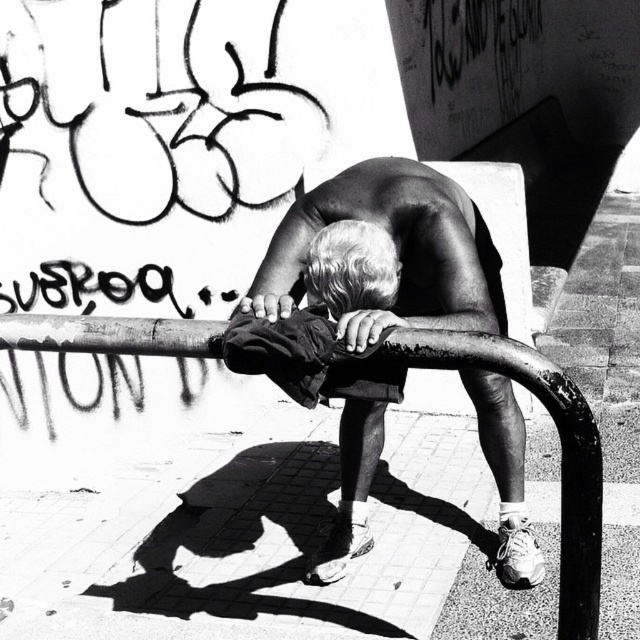
You are an artist trying to sketch the man in the image. To ensure accuracy, you need to know the exact location of his dark fabric shorts at center. Can you describe where they are positioned relative to the image frame?

The dark fabric shorts at center are positioned at coordinates point [332,369] relative to the image frame.

You are a photographer standing in front of the graffiti wall and want to place a small sticker on the point that is closer to you. Which point should you choose between point (x=364, y=228) and point (x=589, y=596)?

Point (x=589, y=596) is closer to you than point (x=364, y=228), so you should place the sticker on point (x=589, y=596).